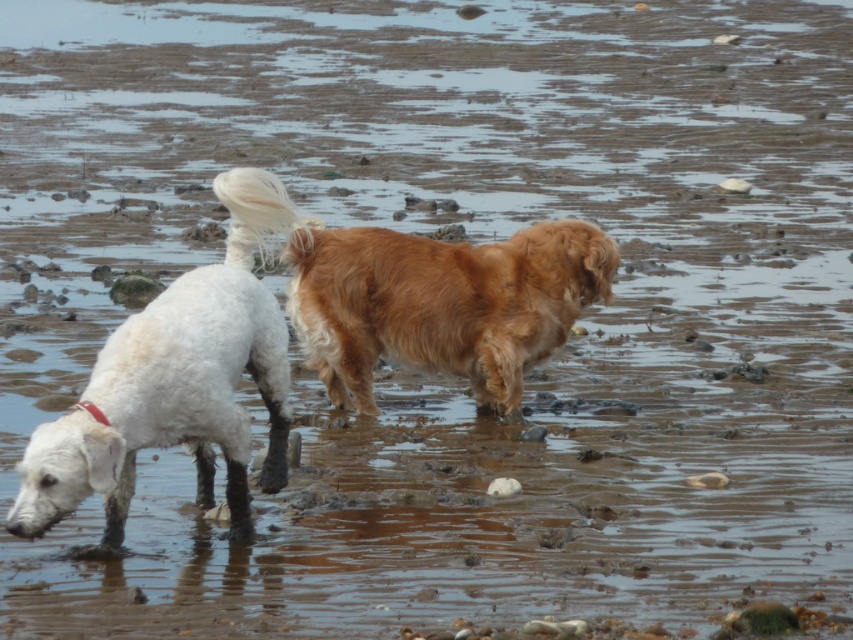
Which of these two, golden fur dog at center or white fluffy dog at left, stands taller?

Standing taller between the two is white fluffy dog at left.

Does point (303, 268) come farther from viewer compared to point (276, 202)?

Yes, it is.

The image size is (853, 640). In order to click on golden fur dog at center in this screenshot , I will do `click(425, 294)`.